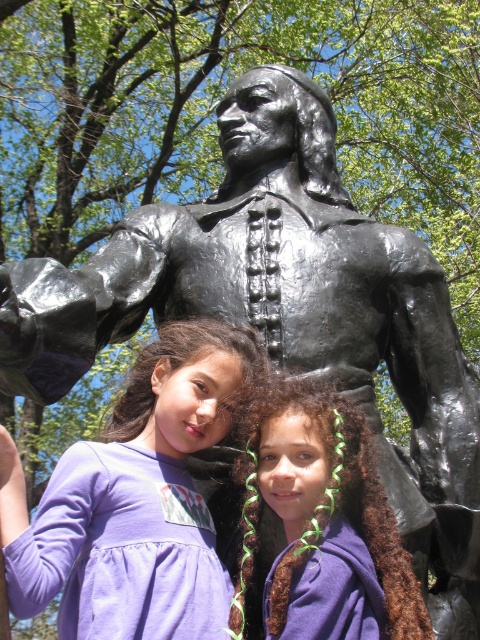
What do you see at coordinates (134, 497) in the screenshot?
I see `purple fabric shirt at lower center` at bounding box center [134, 497].

Between purple fabric shirt at lower center and brown curly hair at center, which one appears on the right side from the viewer's perspective?

Positioned to the right is brown curly hair at center.

Describe the element at coordinates (134, 497) in the screenshot. I see `purple fabric shirt at lower center` at that location.

Find the location of a particular element. Image resolution: width=480 pixels, height=640 pixels. purple fabric shirt at lower center is located at coordinates (134, 497).